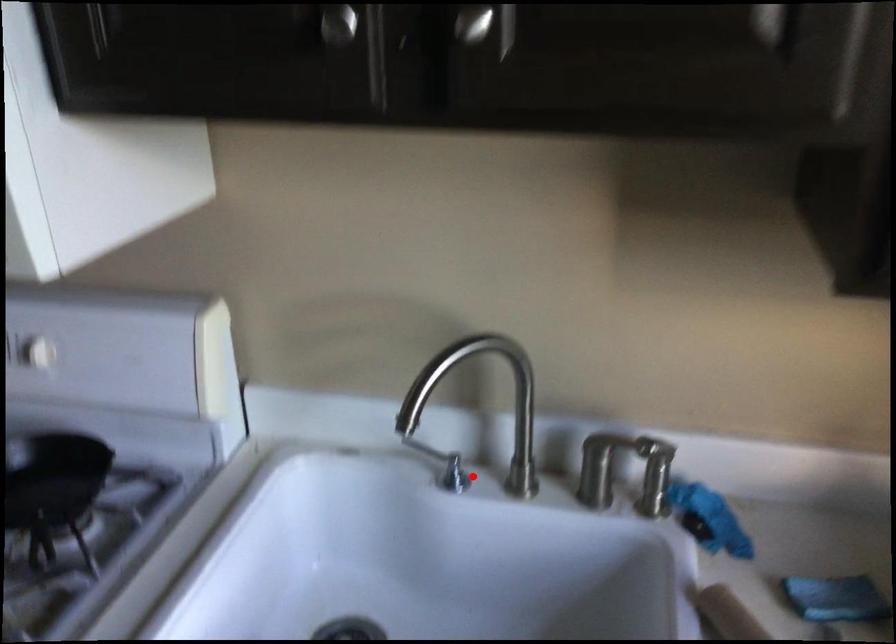
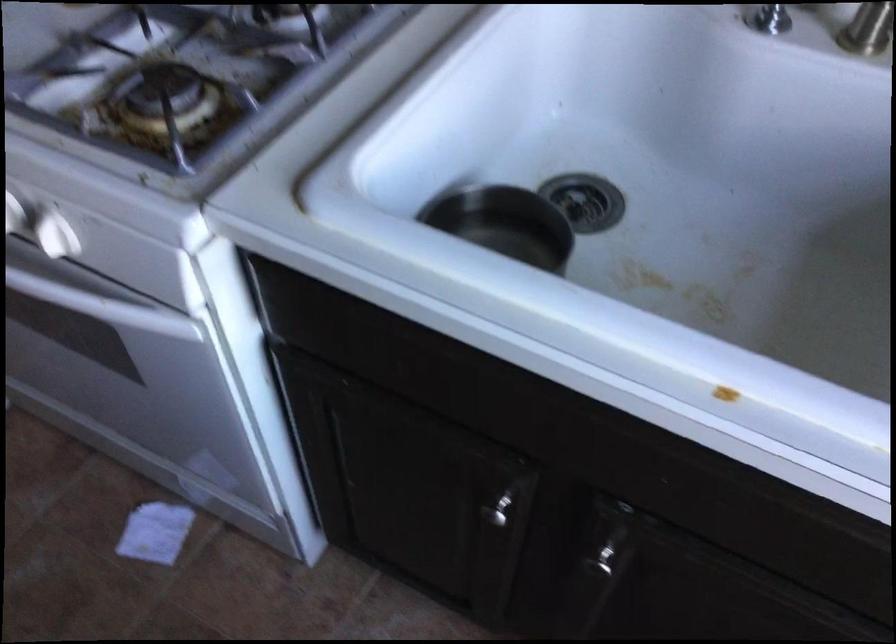
Find the pixel in the second image that matches the highlighted location in the first image.

(787, 15)